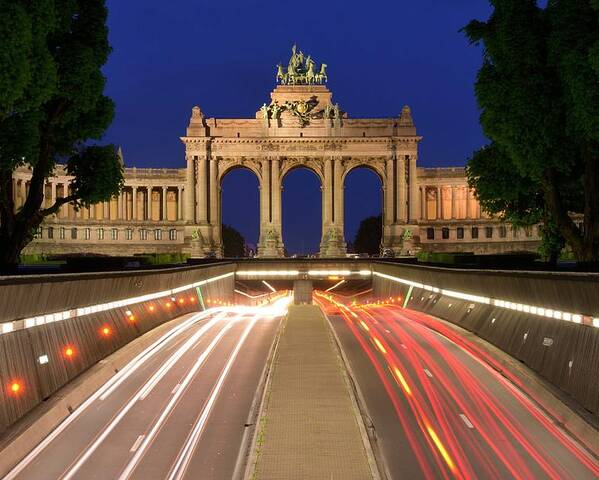
In order to click on yellow lights in this screenshot , I will do `click(446, 459)`.